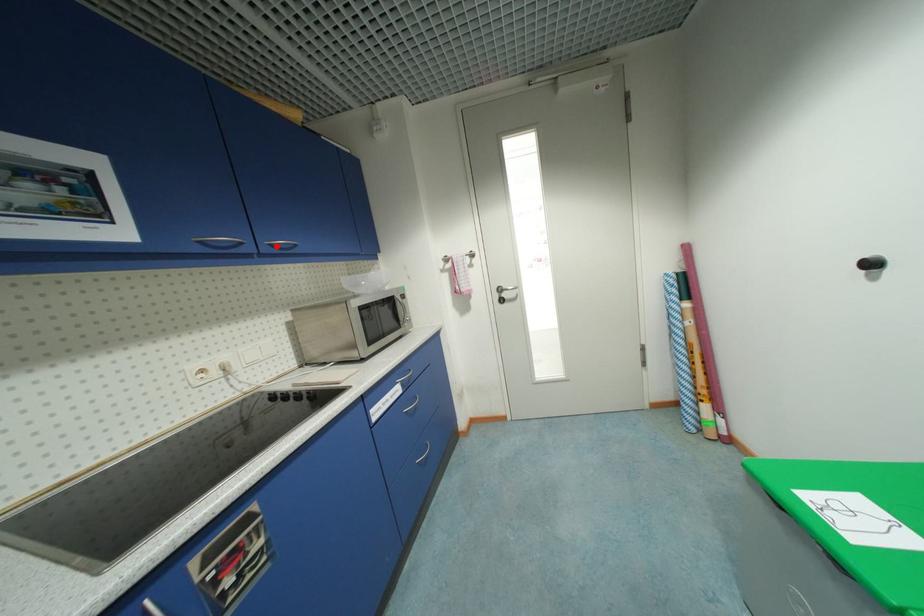
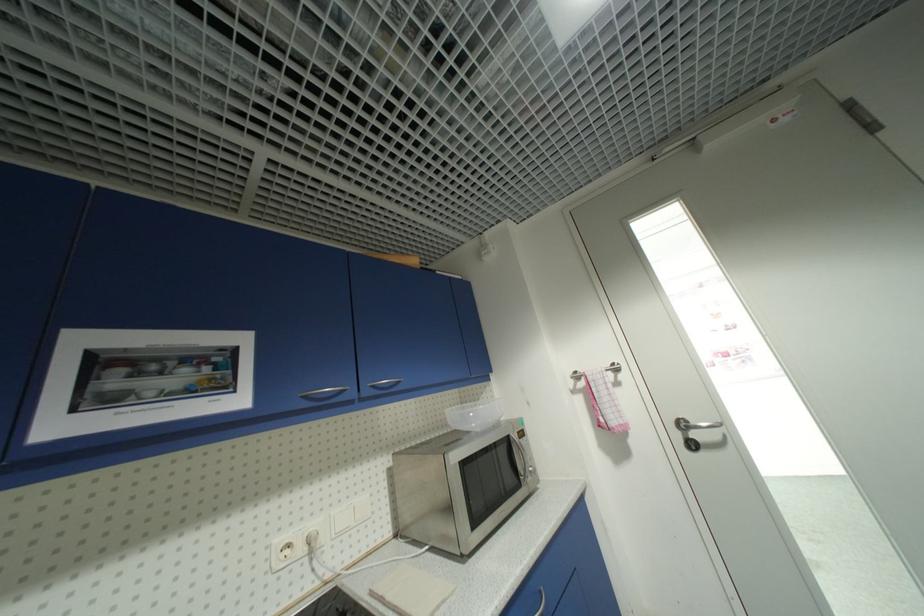
Question: I am providing you with two images of the same scene from different viewpoints. A red point is marked on the first image. Is the red point's position out of view in image 2?

Choices:
 (A) Yes
 (B) No

Answer: (B)